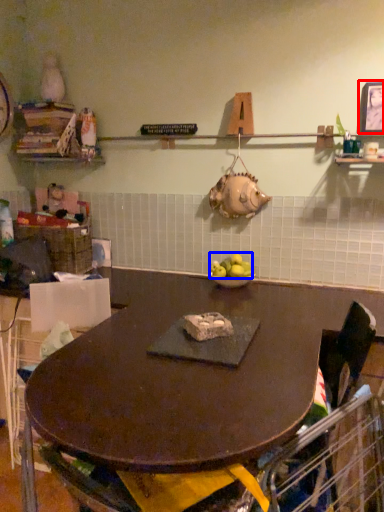
Question: Among these objects, which one is farthest to the camera, picture frame (highlighted by a red box) or apple (highlighted by a blue box)?

Choices:
 (A) picture frame
 (B) apple

Answer: (B)